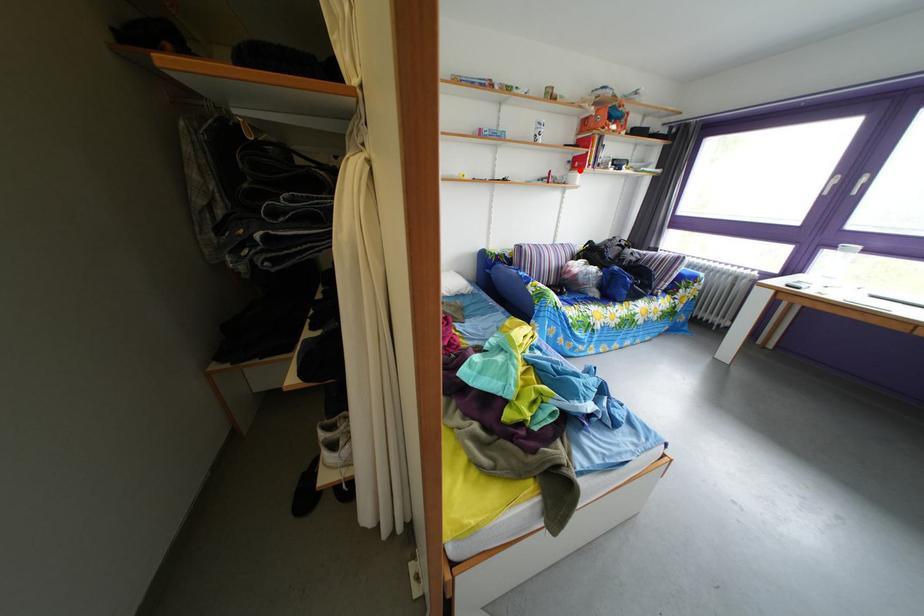
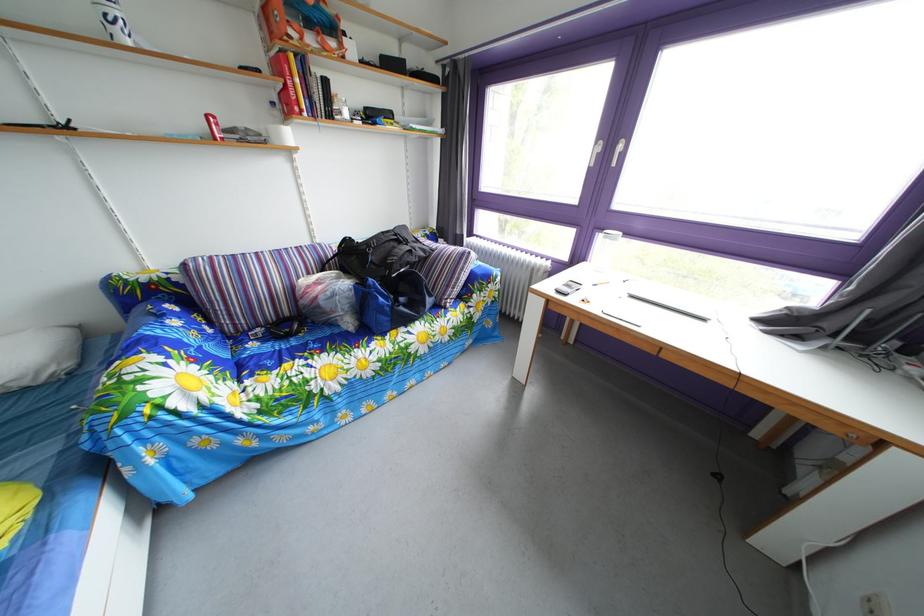
Question: I am providing you with two images of the same scene from different viewpoints. A red point is shown in image1. For the corresponding object point in image2, is it positioned nearer or farther from the camera?

Choices:
 (A) Nearer
 (B) Farther

Answer: (B)